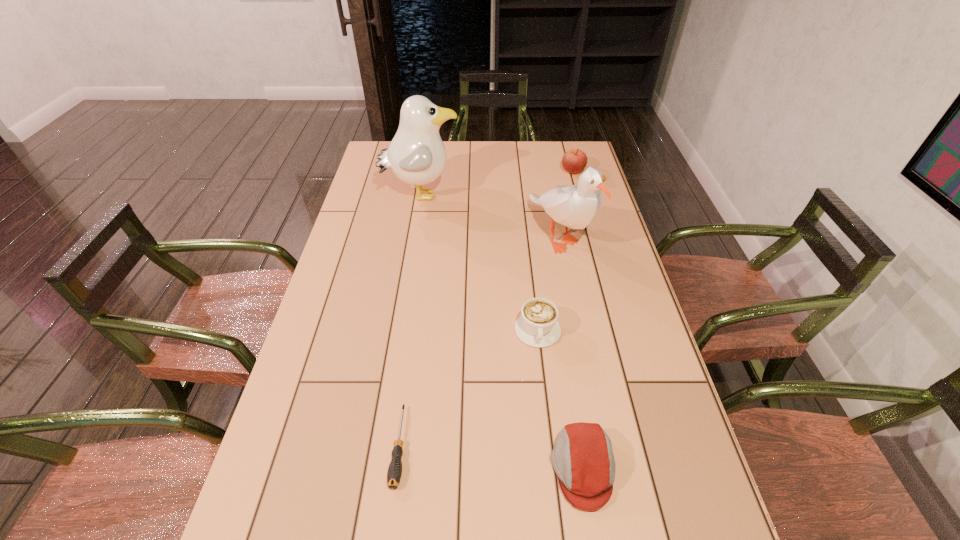
This screenshot has width=960, height=540. I want to click on cap located at the right edge, so click(x=582, y=457).

Where is `object at the far right corner`? This screenshot has width=960, height=540. object at the far right corner is located at coordinates (574, 161).

In the image, there is a desktop. At what (x,y) coordinates should I click in order to perform the action: click on free region at the far edge. Please return your answer as a coordinate pair (x, y). Image resolution: width=960 pixels, height=540 pixels. Looking at the image, I should click on (516, 160).

The image size is (960, 540). In order to click on vacant space at the left edge of the desktop in this screenshot , I will do `click(305, 484)`.

This screenshot has height=540, width=960. In order to click on vacant space at the right edge of the desktop in this screenshot , I will do `click(660, 368)`.

You are a GUI agent. You are given a task and a screenshot of the screen. Output one action in this format:
    pyautogui.click(x=<x>, y=<y>)
    Task: Click on the vacant space at the far left corner of the desktop
    The height and width of the screenshot is (540, 960).
    Given the screenshot: What is the action you would take?
    (379, 153)

The height and width of the screenshot is (540, 960). I want to click on free space between the screwdriver and the left gull, so click(410, 321).

Find the location of a particular element. The width and height of the screenshot is (960, 540). vacant space that is in between the cap and the third tallest object is located at coordinates [x=578, y=320].

This screenshot has height=540, width=960. I want to click on vacant area that lies between the cap and the shorter gull, so click(x=571, y=353).

Where is `free spot between the cap and the fourth farthest object`? The height and width of the screenshot is (540, 960). free spot between the cap and the fourth farthest object is located at coordinates (561, 400).